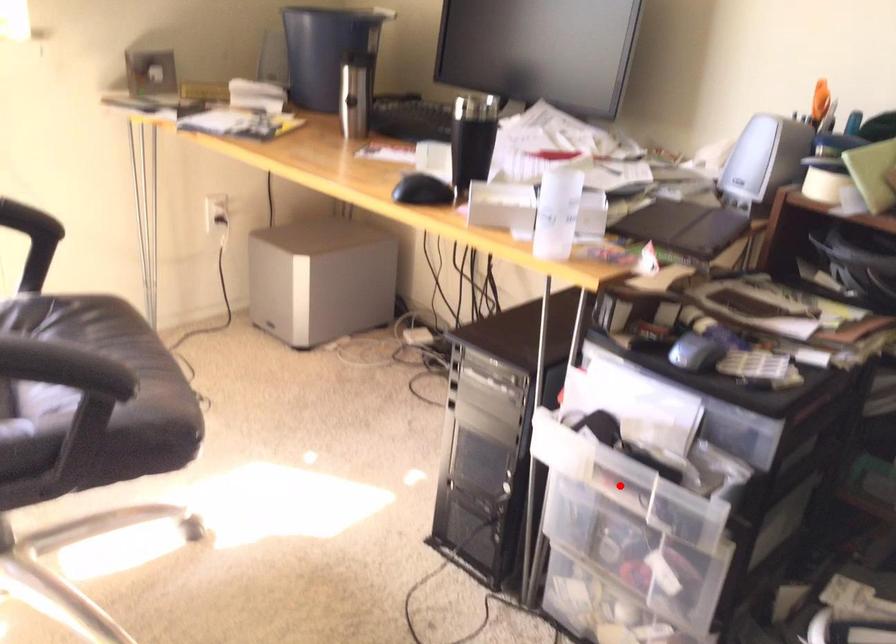
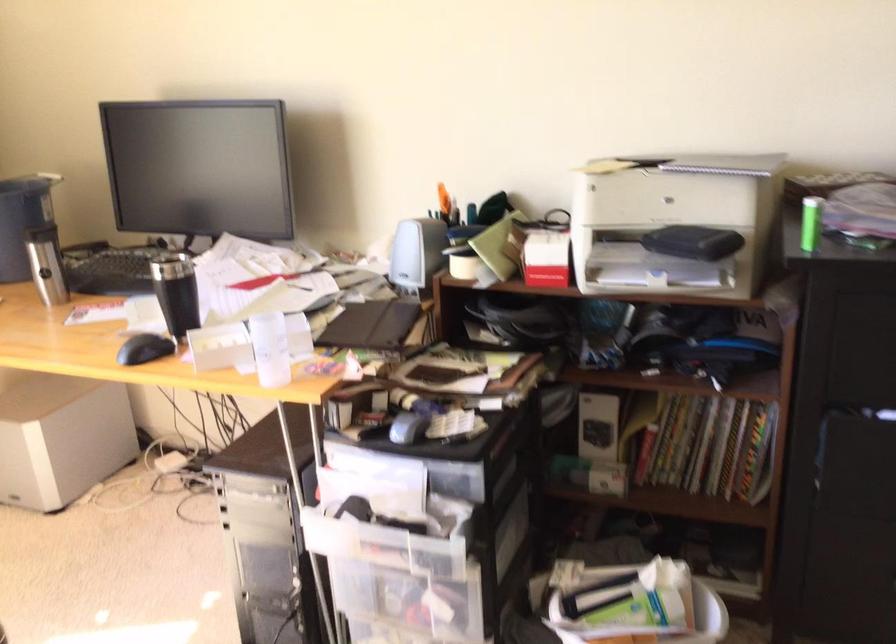
Locate, in the second image, the point that corresponds to the highlighted location in the first image.

(383, 545)